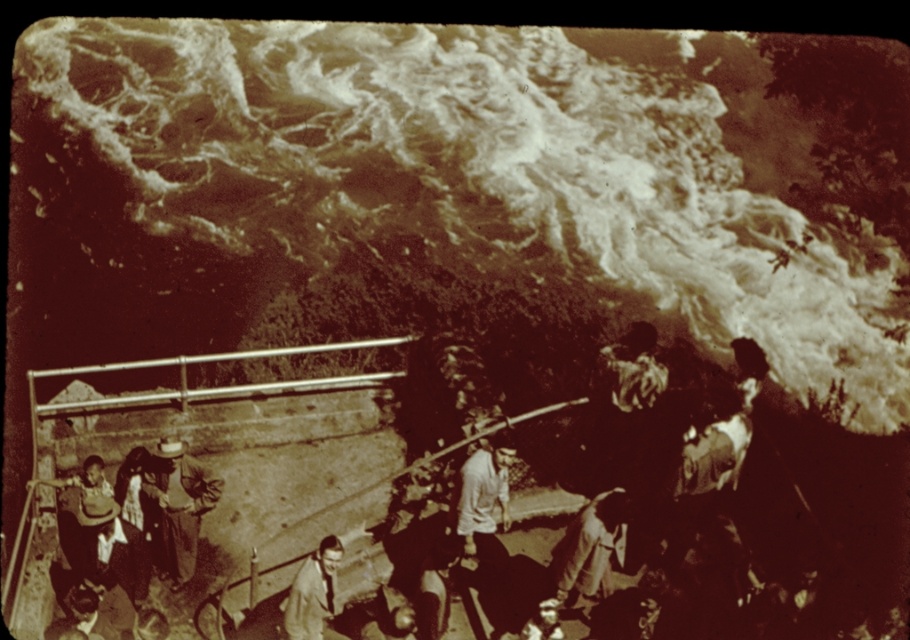
Question: Is light brown fabric shirt at center positioned before light brown leather jacket at lower center?

Choices:
 (A) no
 (B) yes

Answer: (A)

Question: Is light brown fabric shirt at center above light brown leather jacket at lower center?

Choices:
 (A) yes
 (B) no

Answer: (A)

Question: Which point is farther to the camera?

Choices:
 (A) (458, 529)
 (B) (334, 598)

Answer: (A)

Question: Can you confirm if light brown fabric shirt at center is positioned above light brown leather jacket at lower center?

Choices:
 (A) yes
 (B) no

Answer: (A)

Question: Which of the following is the farthest from the observer?

Choices:
 (A) light brown leather jacket at lower center
 (B) light brown fabric shirt at center

Answer: (B)